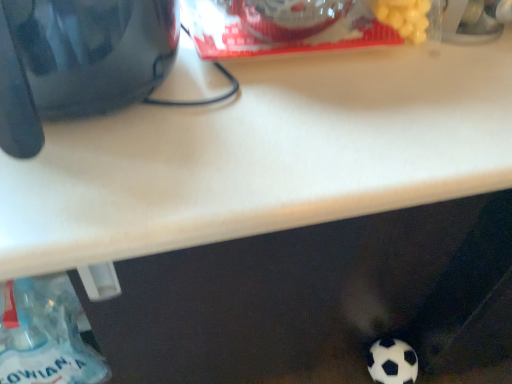
Question: Does glossy black kettle at upper left have a lesser width compared to white matte football at lower right?

Choices:
 (A) yes
 (B) no

Answer: (B)

Question: Is glossy black kettle at upper left with white matte football at lower right?

Choices:
 (A) no
 (B) yes

Answer: (A)

Question: Is glossy black kettle at upper left not close to white matte football at lower right?

Choices:
 (A) yes
 (B) no

Answer: (B)

Question: Considering the relative positions of glossy black kettle at upper left and white matte football at lower right in the image provided, is glossy black kettle at upper left to the right of white matte football at lower right from the viewer's perspective?

Choices:
 (A) yes
 (B) no

Answer: (B)

Question: Can you confirm if glossy black kettle at upper left is wider than white matte football at lower right?

Choices:
 (A) yes
 (B) no

Answer: (A)

Question: Considering the positions of white matte football at lower right and translucent plastic bottle at lower left in the image, is white matte football at lower right bigger or smaller than translucent plastic bottle at lower left?

Choices:
 (A) small
 (B) big

Answer: (A)

Question: Relative to translucent plastic bottle at lower left, is white matte football at lower right in front or behind?

Choices:
 (A) front
 (B) behind

Answer: (B)

Question: From the image's perspective, is white matte football at lower right above or below translucent plastic bottle at lower left?

Choices:
 (A) below
 (B) above

Answer: (A)

Question: Is white matte football at lower right taller or shorter than translucent plastic bottle at lower left?

Choices:
 (A) short
 (B) tall

Answer: (A)

Question: Is white matte football at lower right wider or thinner than glossy black kettle at upper left?

Choices:
 (A) thin
 (B) wide

Answer: (A)

Question: Visually, is white matte football at lower right positioned to the left or to the right of glossy black kettle at upper left?

Choices:
 (A) left
 (B) right

Answer: (B)

Question: From the image's perspective, relative to glossy black kettle at upper left, is white matte football at lower right above or below?

Choices:
 (A) below
 (B) above

Answer: (A)

Question: Is white matte football at lower right taller or shorter than glossy black kettle at upper left?

Choices:
 (A) tall
 (B) short

Answer: (B)

Question: Visually, is translucent plastic bottle at lower left positioned to the left or to the right of white matte football at lower right?

Choices:
 (A) right
 (B) left

Answer: (B)

Question: From a real-world perspective, relative to white matte football at lower right, is translucent plastic bottle at lower left vertically above or below?

Choices:
 (A) below
 (B) above

Answer: (B)